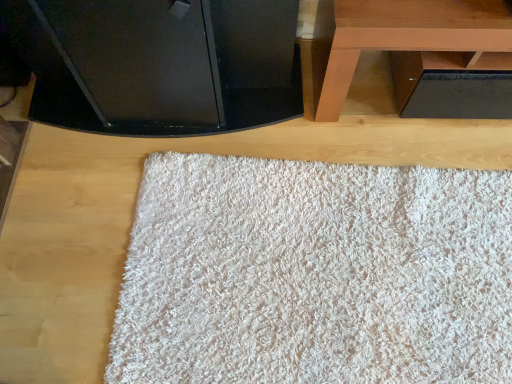
I want to click on vacant space that is in between black glossy tv at upper center and white fluffy rug at center, so click(139, 185).